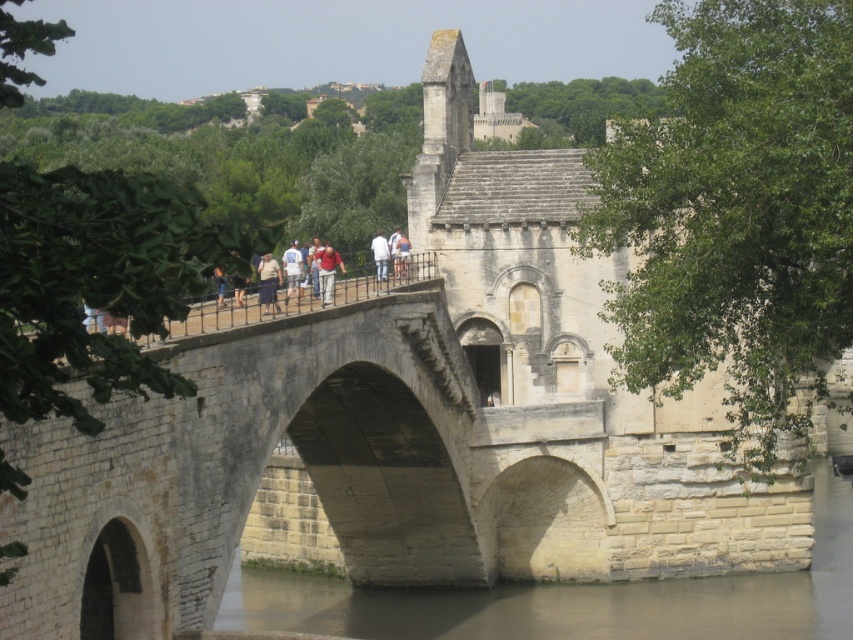
Is red shirt at center positioned at the back of white cotton shirt at center?

Yes, red shirt at center is further from the viewer.

How distant is red shirt at center from white cotton shirt at center?

6.66 feet

Who is more distant from viewer, (x=328, y=284) or (x=287, y=276)?

Positioned behind is point (x=287, y=276).

Where is `red shirt at center`? red shirt at center is located at coordinates (328, 269).

Can you confirm if red shirt at center is positioned below light brown leather jacket at center?

No.

Which is in front, point (326, 262) or point (271, 260)?

Point (271, 260)

Where is `red shirt at center`? red shirt at center is located at coordinates (328, 269).

Does stone arch bridge at center come in front of light brown leather jacket at center?

No, it is not.

The width and height of the screenshot is (853, 640). I want to click on stone arch bridge at center, so click(x=248, y=468).